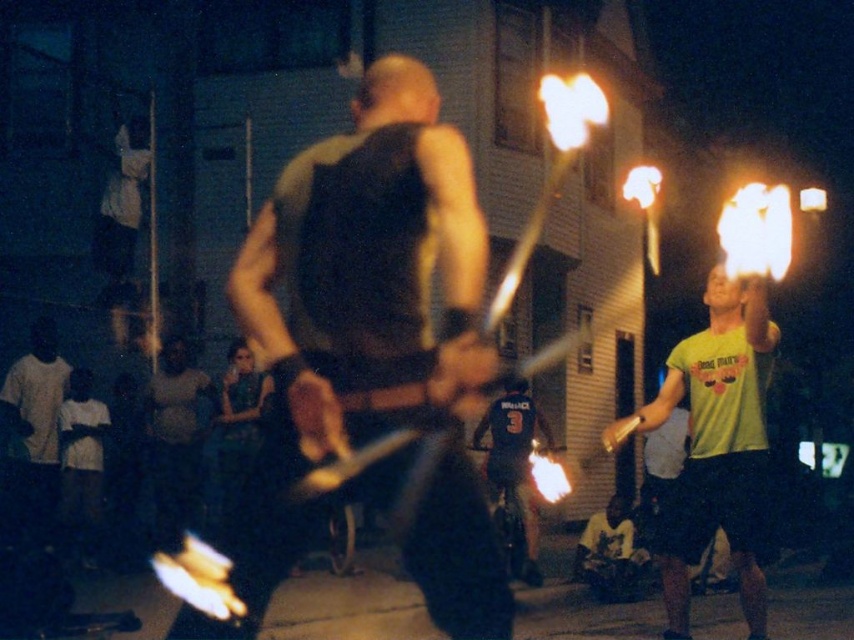
You are standing in the nighttime scene watching the fire performers. You notice two points marked in the image. Which point, point 1 at coordinates (313, 324) or point 2 at coordinates (528, 496), is closer to you?

Point 1 at coordinates (313, 324) is closer to you than point 2 at coordinates (528, 496).

You are a photographer trying to capture a clear photo of both the dark gray tank top at center and the dark blue jersey at center. Since the scene is dimly lit, you need to adjust your camera settings. Which subject should you focus on first to ensure both are in focus?

The dark gray tank top at center is in front of the dark blue jersey at center, so you should focus on the dark gray tank top at center first to ensure both are in focus.